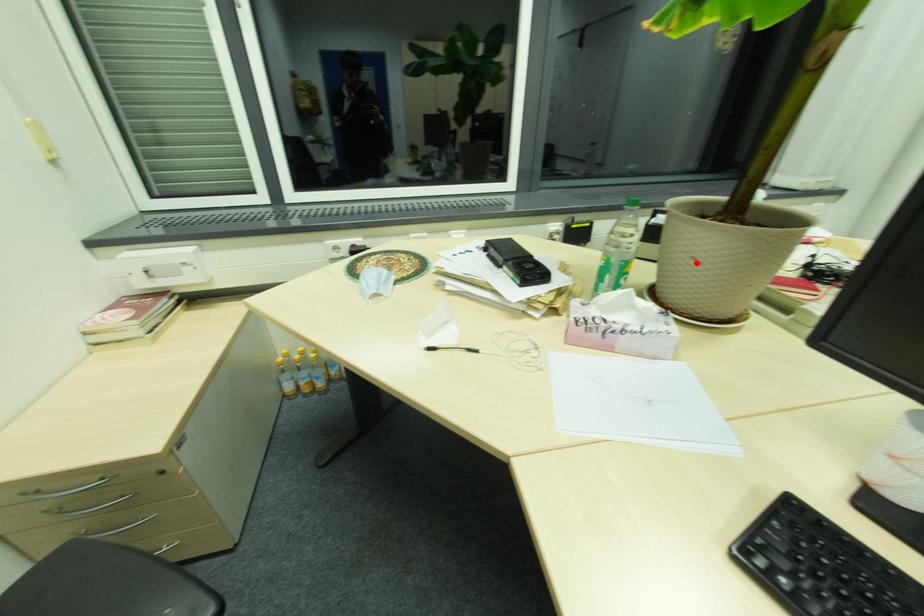
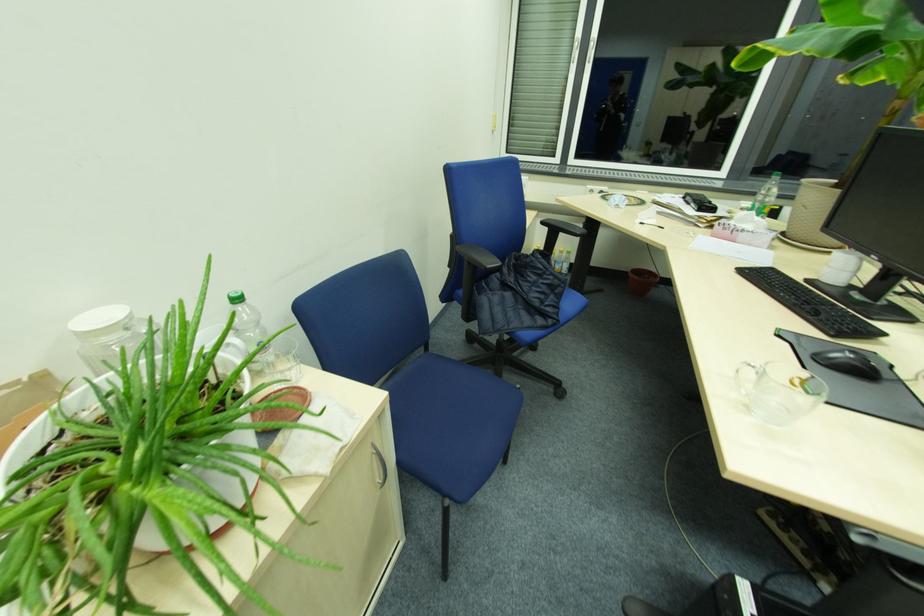
Question: I am providing you with two images of the same scene from different viewpoints. A red point is marked on the first image. Is the red point's position out of view in image 2?

Choices:
 (A) Yes
 (B) No

Answer: (B)